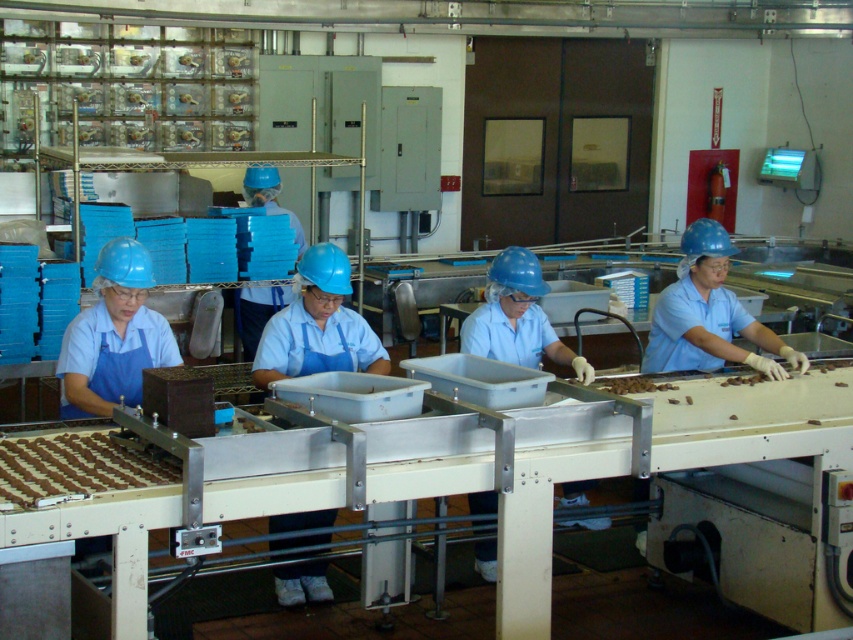
Question: Which of the following is the farthest from the observer?

Choices:
 (A) chocolate matte at lower left
 (B) light blue fabric at center
 (C) brown matte chocolate at center
 (D) blue fabric shirt at center

Answer: (C)

Question: Can you confirm if matte blue hard hat at left is wider than brown matte chocolate at center?

Choices:
 (A) yes
 (B) no

Answer: (A)

Question: Which of these objects is positioned closest to the blue fabric shirt at center?

Choices:
 (A) blue matte helmet at right
 (B) matte blue hard hat at left
 (C) brown matte chocolate at center

Answer: (B)

Question: Can you confirm if blue fabric shirt at center is positioned above chocolate matte at lower left?

Choices:
 (A) no
 (B) yes

Answer: (B)

Question: Is blue fabric gloves at center to the left of brown matte chocolate at center from the viewer's perspective?

Choices:
 (A) no
 (B) yes

Answer: (B)

Question: Which point is closer to the camera?

Choices:
 (A) (285, 292)
 (B) (131, 285)
 (C) (668, 296)

Answer: (B)